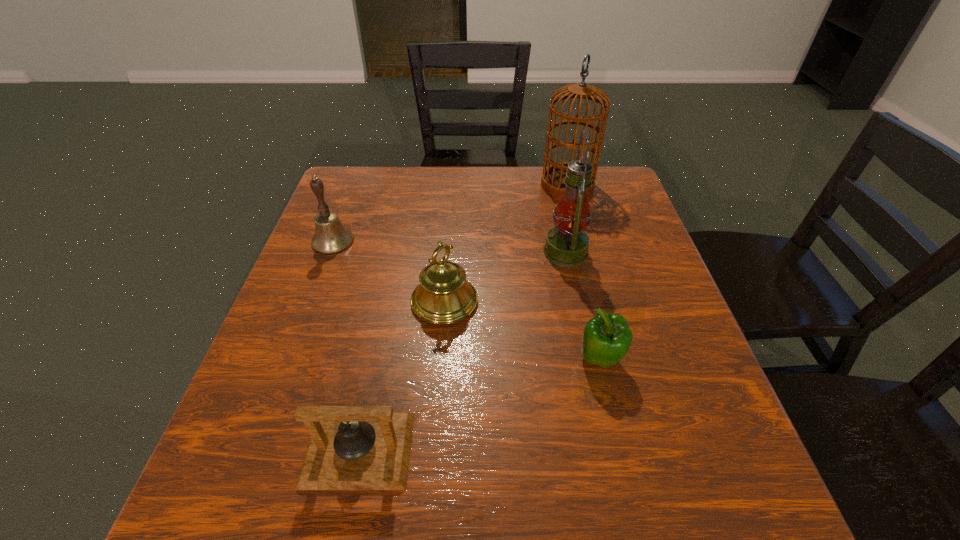
Locate an element on the screen. The width and height of the screenshot is (960, 540). the tallest object is located at coordinates (552, 181).

At what (x,y) coordinates should I click in order to perform the action: click on the farthest object. Please return your answer as a coordinate pair (x, y). Image resolution: width=960 pixels, height=540 pixels. Looking at the image, I should click on point(552,181).

Locate an element on the screen. This screenshot has height=540, width=960. the fifth shortest object is located at coordinates (567, 243).

The height and width of the screenshot is (540, 960). I want to click on the leftmost bell, so click(331, 237).

Locate an element on the screen. The width and height of the screenshot is (960, 540). the leftmost object is located at coordinates (331, 237).

The image size is (960, 540). In order to click on the second shortest bell in this screenshot , I will do `click(444, 296)`.

Find the location of a particular element. The height and width of the screenshot is (540, 960). the second farthest bell is located at coordinates (444, 296).

The image size is (960, 540). I want to click on the second nearest object, so click(607, 337).

What are the coordinates of `the shortest bell` in the screenshot? It's located at (351, 447).

I want to click on the nearest object, so click(x=351, y=447).